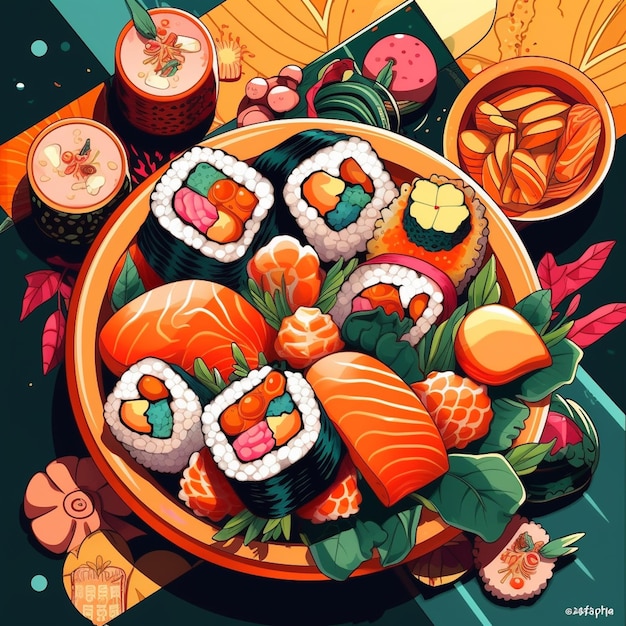
This screenshot has height=626, width=626. Identify the location of illustrated plate. (155, 531).